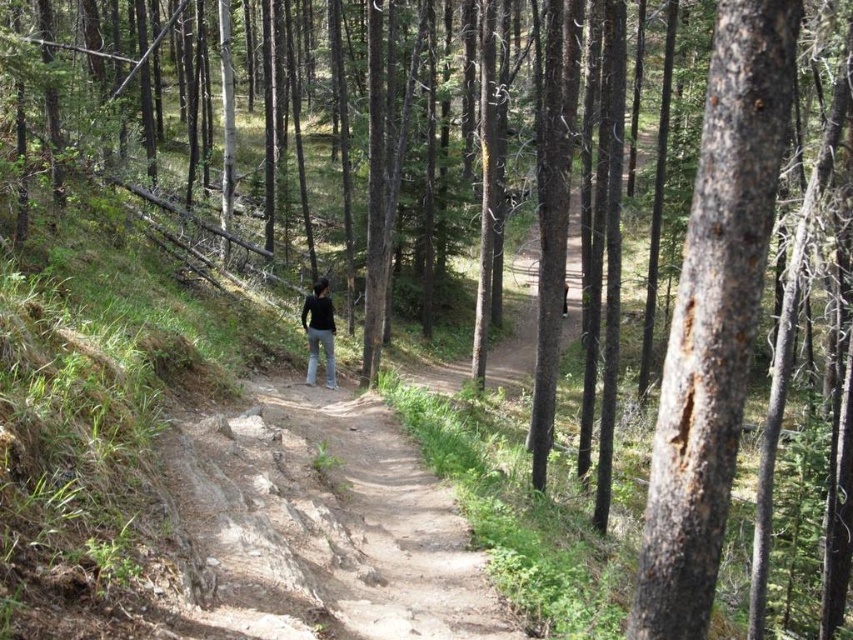
You are a hiker trying to navigate through the forest path. You notice a brown rough bark tree at center right and dark gray jeans at center. Which object is wider?

The dark gray jeans at center is wider than the brown rough bark tree at center right.

You are standing at the point marked as point (x=714, y=317) in the forest scene. Looking around, you see a brown rough bark tree at center right. Which direction should you walk to reach the dirt path that is visible in the scene?

The dirt path is visible in the scene, so you should walk towards it. Since the brown rough bark tree at center right is located at point (x=714, y=317), you are already at that location. To reach the dirt path, you would need to move towards the path which is winding through the forest as described in the scene.